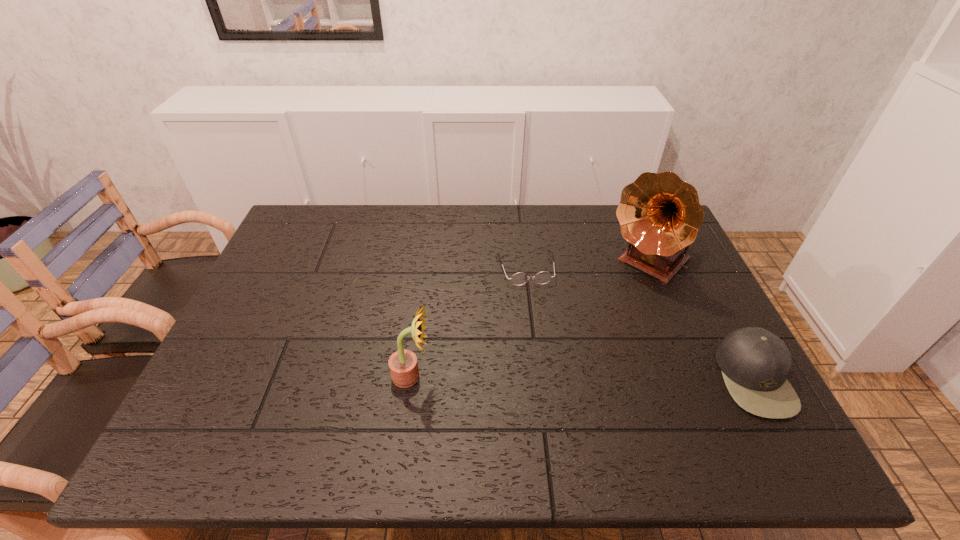
Locate an element on the screen. The height and width of the screenshot is (540, 960). vacant space on the desktop that is between the third shortest object and the cap and is positioned on the horn of the tallest object is located at coordinates (538, 377).

Where is `free space on the desktop that is between the leftmost object and the cap and is positioned through the lenses of the shortest object`? This screenshot has height=540, width=960. free space on the desktop that is between the leftmost object and the cap and is positioned through the lenses of the shortest object is located at coordinates (550, 377).